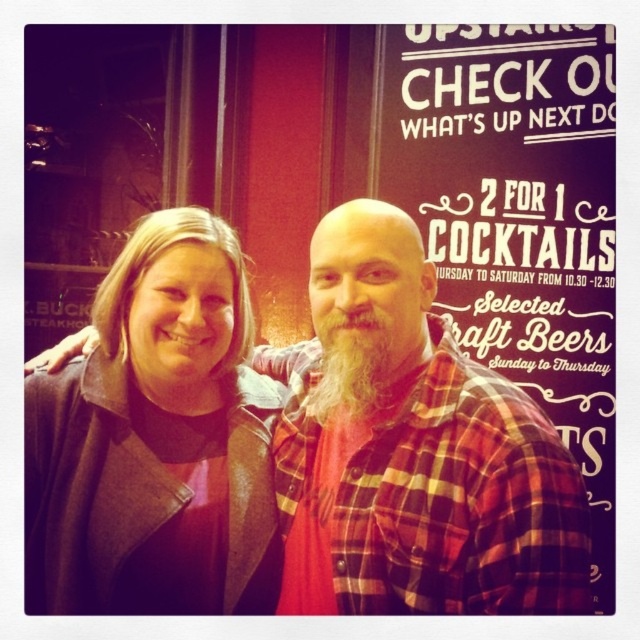
Question: Where is plaid flannel shirt at center located in relation to dark brown leather jacket at center in the image?

Choices:
 (A) below
 (B) above

Answer: (A)

Question: Can you confirm if plaid flannel shirt at center is positioned to the left of dark brown leather jacket at center?

Choices:
 (A) no
 (B) yes

Answer: (A)

Question: Is plaid flannel shirt at center further to the viewer compared to dark brown leather jacket at center?

Choices:
 (A) no
 (B) yes

Answer: (A)

Question: Which of the following is the farthest from the observer?

Choices:
 (A) (243, 472)
 (B) (436, 504)
 (C) (390, 368)

Answer: (C)

Question: Which point is closer to the camera?

Choices:
 (A) graywoollybeard at center
 (B) dark brown leather jacket at center

Answer: (B)

Question: Considering the real-world distances, which object is farthest from the graywoollybeard at center?

Choices:
 (A) dark brown leather jacket at center
 (B) plaid flannel shirt at center

Answer: (A)